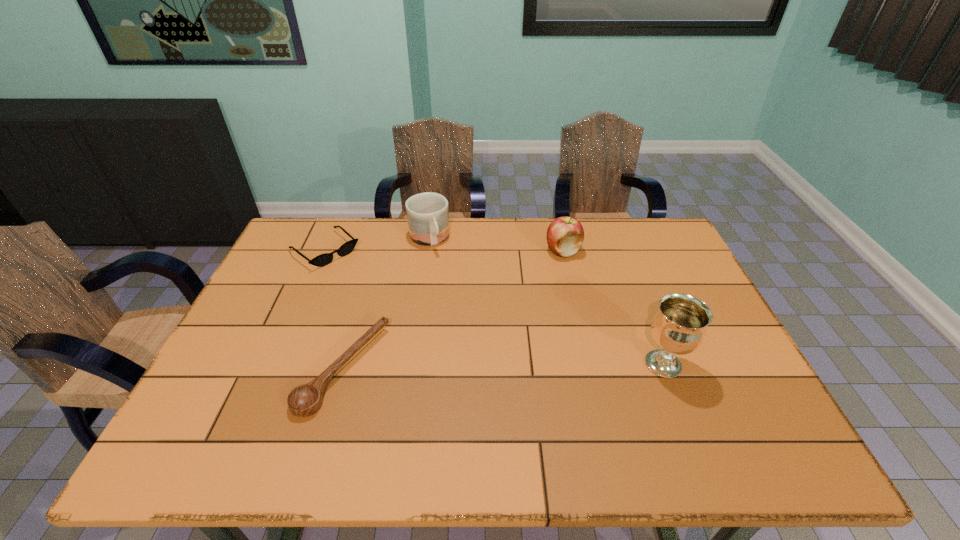
In order to click on vacant position in the image that satisfies the following two spatial constraints: 1. on the front side of the mug; 2. on the left side of the apple in this screenshot , I will do `click(427, 250)`.

Locate an element on the screen. vacant point that satisfies the following two spatial constraints: 1. on the front side of the mug; 2. on the left side of the tallest object is located at coordinates (411, 364).